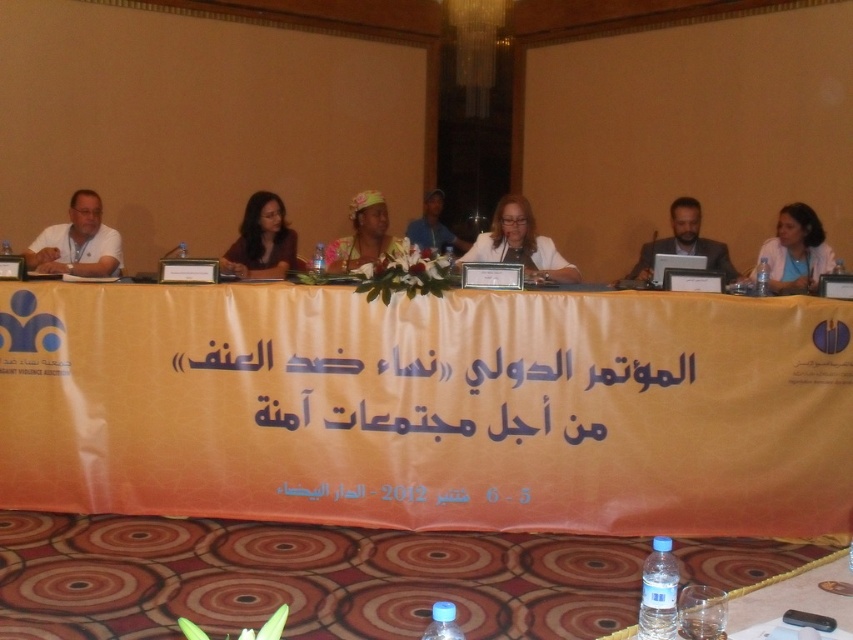
What is the 2D coordinate of the orange paper banner at center?

The orange paper banner at center is located at the 2D coordinate point of (422, 387).

You are a photographer who needs to capture a clear image of the orange fabric banner at center and the matte white laptop at center. Since both items are on the table, which one should you focus on first to ensure both are in focus without moving your camera?

The orange fabric banner at center is located below the matte white laptop at center. Since they are stacked vertically, focusing on the matte white laptop at center first will allow the banner to remain in focus as it is behind the laptop in the depth of field.

You are attending the International Conference Against Violence for Safe Communities and need to locate your assigned seat. You remember that your seat has a matte white laptop at center and a matte yellow headscarf at center. Based on the scene description, which object should you look for first to find your seat?

The matte white laptop at center is below the matte yellow headscarf at center, so you should look for the matte yellow headscarf at center first as it is positioned above the laptop.